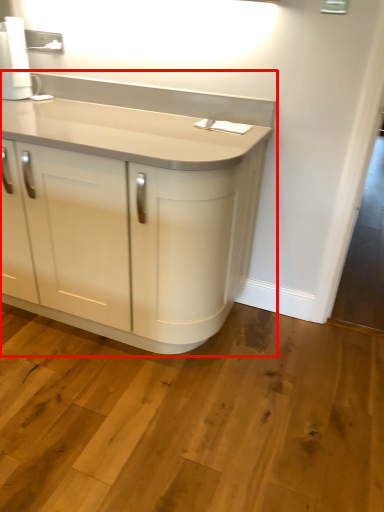
Question: Considering the relative positions of cupboard (annotated by the red box) and paper towel in the image provided, where is cupboard (annotated by the red box) located with respect to the staircase?

Choices:
 (A) left
 (B) right

Answer: (B)